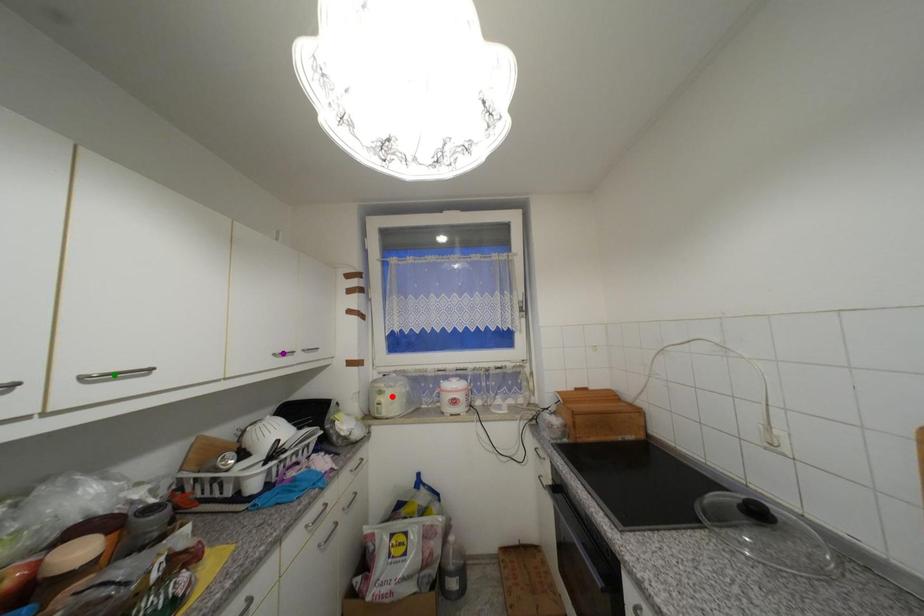
Order these from nearest to farthest:
1. purple point
2. red point
3. green point

green point → purple point → red point